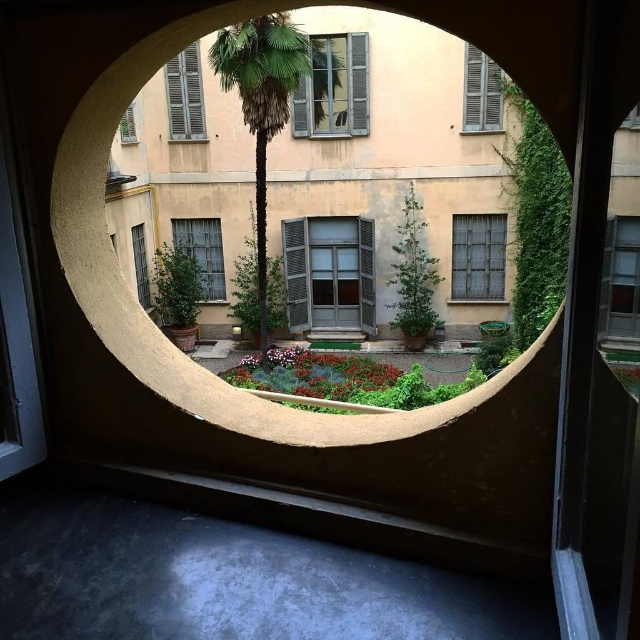
Question: Is clear glass window at center below white wooden shutters at upper left?

Choices:
 (A) no
 (B) yes

Answer: (B)

Question: Observing the image, what is the correct spatial positioning of smooth beige archway at center in reference to green leafy palm tree at center?

Choices:
 (A) below
 (B) above

Answer: (A)

Question: Is white wooden shutters at upper left closer to the viewer compared to wooden shutters at upper right?

Choices:
 (A) yes
 (B) no

Answer: (B)

Question: Which point is farther from the camera taking this photo?

Choices:
 (A) (472, 276)
 (B) (330, 312)

Answer: (B)

Question: Which point appears closest to the camera in this image?

Choices:
 (A) (177, 221)
 (B) (612, 292)
 (C) (326, 269)
 (D) (490, 288)

Answer: (B)

Question: Which point appears farthest from the camera in this image?

Choices:
 (A) (76, 156)
 (B) (195, 72)

Answer: (B)